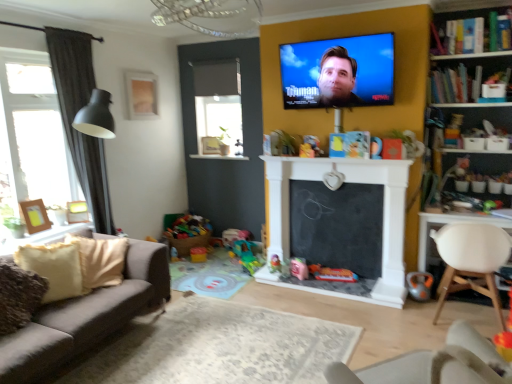
What are the coordinates of `empty space that is in between metallic orange toy at lower right, which ranks as the first toy in bottom-to-top order, and white matte chair at right, which is the 1th chair from right to left` in the screenshot? It's located at (420, 308).